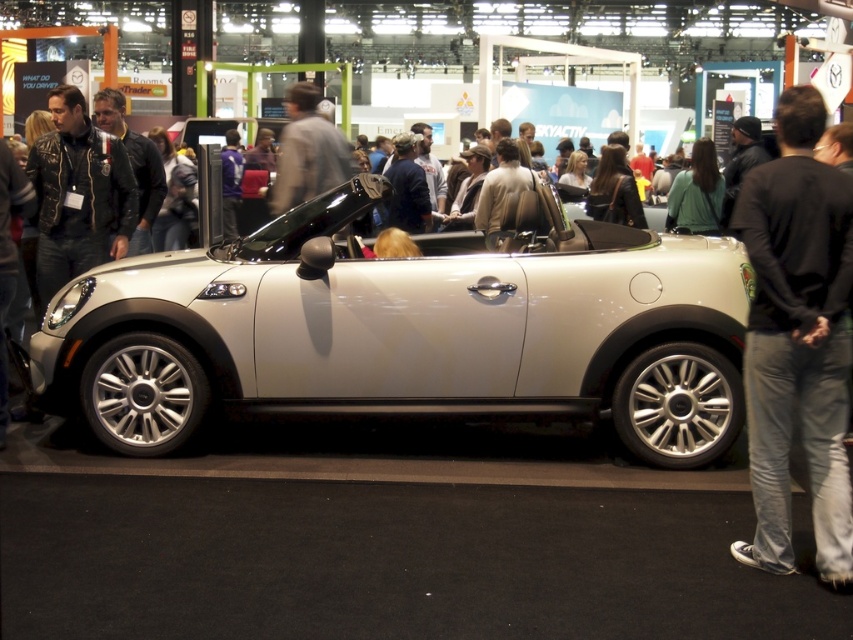
Where is the satin silver car at center located in the image?

The satin silver car at center is located at point (405, 333) in the image.

You are at an auto show and want to take a photo of the silver Mini Cooper Convertible. There are two people blocking your view. One is wearing dark gray jeans at right and the other is wearing a leather jacket at left. Which person should you ask to move so you can get a clear shot of the car?

You should ask the dark gray jeans at right to move because they are positioned to the right of the leather jacket at left, which might be closer to the car or blocking the view from the right side.